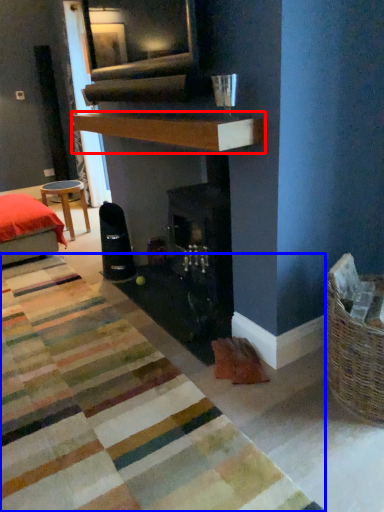
Question: Which of the following is the farthest to the observer, mantle (highlighted by a red box) or mat (highlighted by a blue box)?

Choices:
 (A) mantle
 (B) mat

Answer: (A)